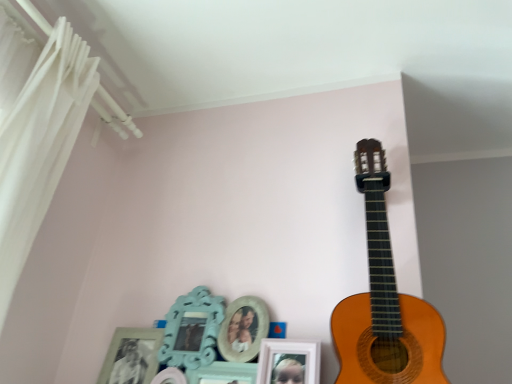
Question: From the image's perspective, is wooden acoustic guitar at upper right located above or below white sheer curtain at left?

Choices:
 (A) above
 (B) below

Answer: (B)

Question: From their relative heights in the image, would you say wooden acoustic guitar at upper right is taller or shorter than white sheer curtain at left?

Choices:
 (A) short
 (B) tall

Answer: (A)

Question: From a real-world perspective, relative to white sheer curtain at left, is wooden acoustic guitar at upper right vertically above or below?

Choices:
 (A) below
 (B) above

Answer: (A)

Question: Looking at their shapes, would you say white sheer curtain at left is wider or thinner than wooden acoustic guitar at upper right?

Choices:
 (A) wide
 (B) thin

Answer: (A)

Question: In terms of height, does white sheer curtain at left look taller or shorter compared to wooden acoustic guitar at upper right?

Choices:
 (A) tall
 (B) short

Answer: (A)

Question: Is point (67, 142) closer or farther from the camera than point (392, 365)?

Choices:
 (A) farther
 (B) closer

Answer: (A)

Question: Considering their positions, is white sheer curtain at left located in front of or behind wooden acoustic guitar at upper right?

Choices:
 (A) front
 (B) behind

Answer: (A)